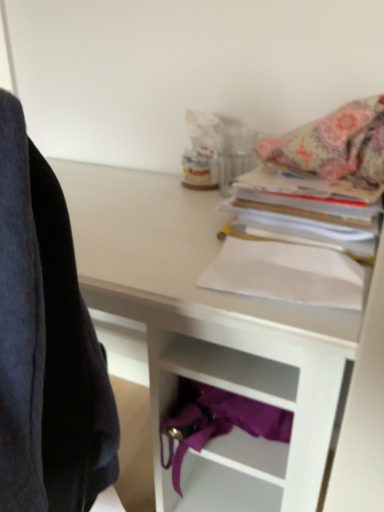
Identify the location of free point to the left of white paper at center, positioned as the 2th paperback book in top-to-bottom order. This screenshot has width=384, height=512. click(153, 267).